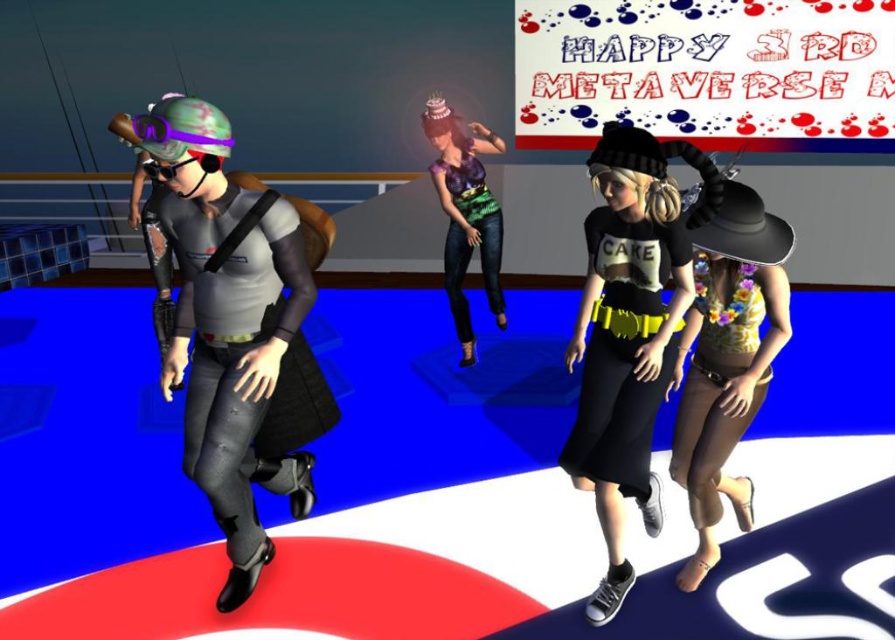
You are an avatar standing at the edge of the stage in the metaverse scene. You want to hand a virtual flower to the avatar wearing the floral yellow tank top at center. The virtual flower you hold can be thrown up to 6 feet. Can you reach them with the flower?

The floral yellow tank top at center is 6.30 feet away from the camera, which is slightly beyond the 6 feet range of the virtual flower. Therefore, you cannot reach them with the flower.